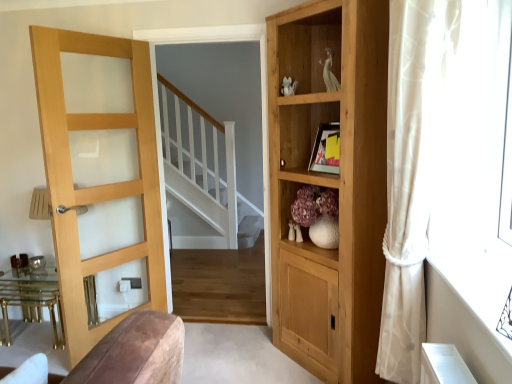
Question: Can you confirm if white matte vase at center is thinner than light wood/glass door at left?

Choices:
 (A) no
 (B) yes

Answer: (A)

Question: Is white matte vase at center taller than light wood/glass door at left?

Choices:
 (A) yes
 (B) no

Answer: (B)

Question: From the image's perspective, is white matte vase at center under light wood/glass door at left?

Choices:
 (A) no
 (B) yes

Answer: (B)

Question: Can you confirm if white matte vase at center is bigger than light wood/glass door at left?

Choices:
 (A) no
 (B) yes

Answer: (A)

Question: Considering the relative positions of white matte vase at center and light wood/glass door at left in the image provided, is white matte vase at center in front of light wood/glass door at left?

Choices:
 (A) no
 (B) yes

Answer: (A)

Question: Visually, is white matte vase at center positioned to the left or to the right of light wood/glass door at left?

Choices:
 (A) right
 (B) left

Answer: (A)

Question: From their relative heights in the image, would you say white matte vase at center is taller or shorter than light wood/glass door at left?

Choices:
 (A) short
 (B) tall

Answer: (A)

Question: In terms of width, does white matte vase at center look wider or thinner when compared to light wood/glass door at left?

Choices:
 (A) wide
 (B) thin

Answer: (A)

Question: From a real-world perspective, is white matte vase at center physically located above or below light wood/glass door at left?

Choices:
 (A) above
 (B) below

Answer: (B)

Question: Is point (329, 243) positioned closer to the camera than point (409, 61)?

Choices:
 (A) farther
 (B) closer

Answer: (A)

Question: Is white matte vase at center in front of or behind sheer white curtain at right in the image?

Choices:
 (A) behind
 (B) front

Answer: (A)

Question: In terms of height, does white matte vase at center look taller or shorter compared to sheer white curtain at right?

Choices:
 (A) tall
 (B) short

Answer: (B)

Question: From a real-world perspective, is white matte vase at center physically located above or below sheer white curtain at right?

Choices:
 (A) above
 (B) below

Answer: (B)

Question: Considering the positions of sheer white curtain at right and light wood/glass door at left in the image, is sheer white curtain at right bigger or smaller than light wood/glass door at left?

Choices:
 (A) big
 (B) small

Answer: (B)

Question: Is sheer white curtain at right in front of or behind light wood/glass door at left in the image?

Choices:
 (A) front
 (B) behind

Answer: (A)